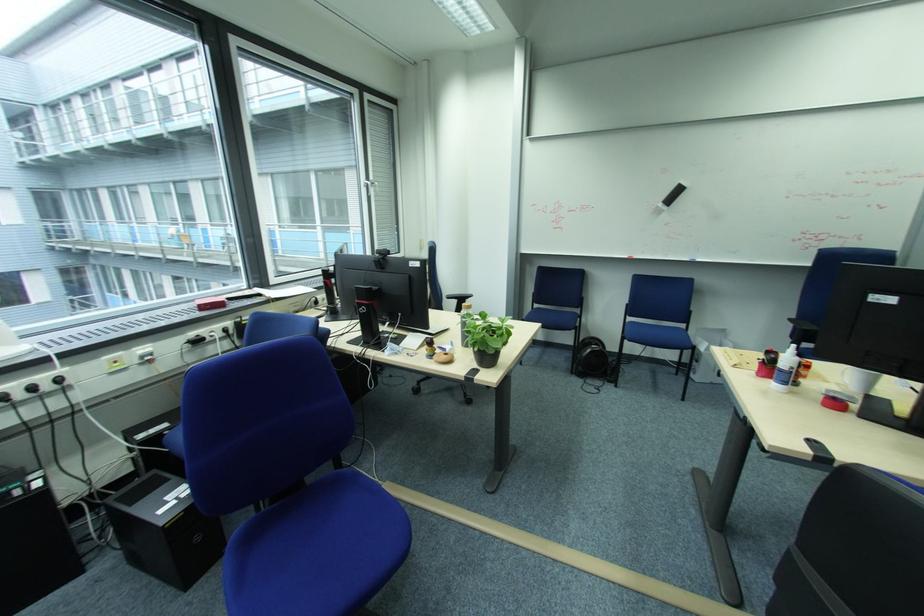
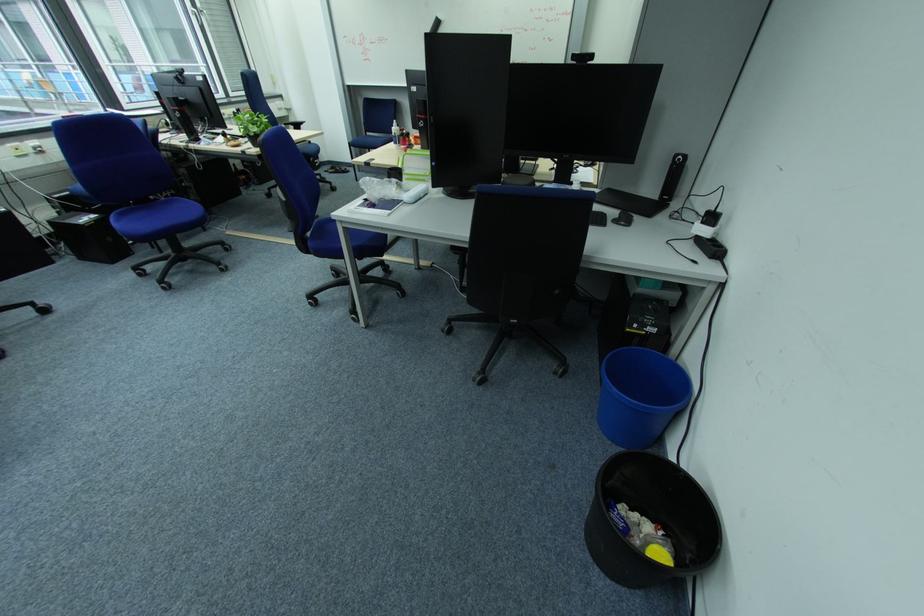
The point at (545, 306) is marked in the first image. Where is the corresponding point in the second image?

(378, 135)